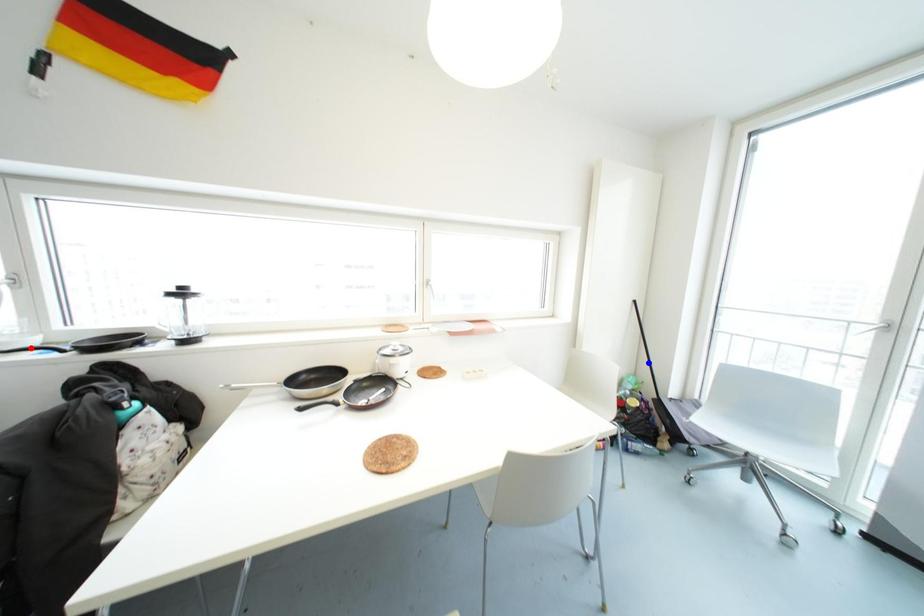
Question: Which of the two points in the image is closer to the camera?

Choices:
 (A) Blue point is closer.
 (B) Red point is closer.

Answer: (B)